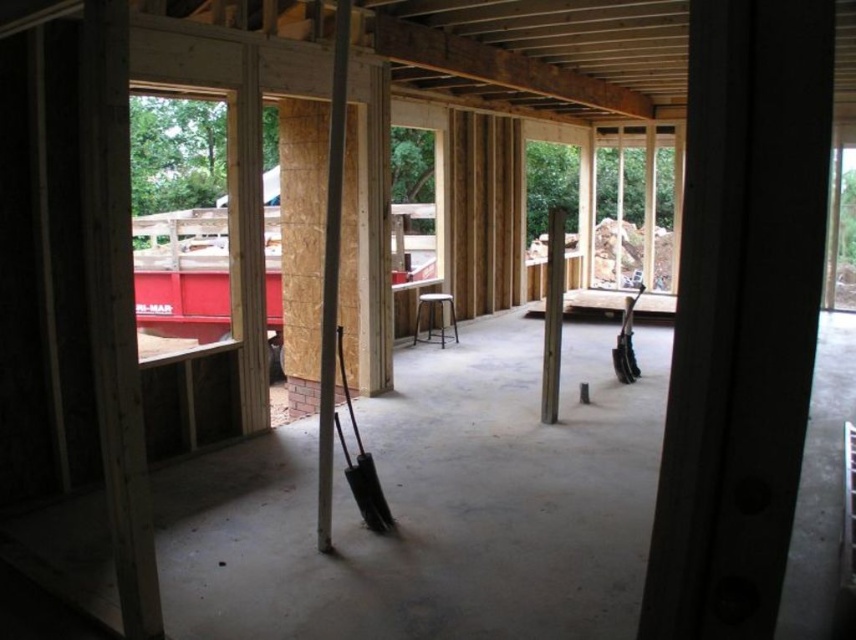
You are a construction worker standing in the unfinished room. You need to move the black plastic shovel at center to the other side of the smooth wood pillar at center. Which object will you have to move first?

You will have to move the smooth wood pillar at center first because it is closer to you than the black plastic shovel at center, so it is blocking the path to the shovel.

You are an architect designing the lighting for this construction site. You need to place a spotlight at the center of the room. Where should you aim the spotlight to ensure it illuminates the smooth wood beam at center?

The smooth wood beam at center is located at point coordinates of (331, 273), so the spotlight should be aimed at those coordinates to illuminate it properly.